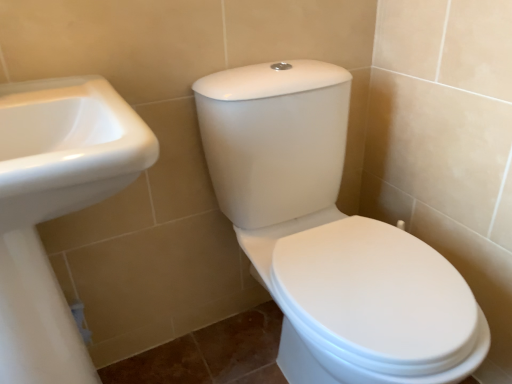
Describe the element at coordinates (55, 209) in the screenshot. I see `white glossy sink at left` at that location.

The height and width of the screenshot is (384, 512). What are the coordinates of `white glossy sink at left` in the screenshot? It's located at (55, 209).

Measure the distance between point (338, 320) and camera.

The depth of point (338, 320) is 74.00 centimeters.

Image resolution: width=512 pixels, height=384 pixels. What do you see at coordinates (329, 236) in the screenshot? I see `white glossy toilet at center` at bounding box center [329, 236].

You are a GUI agent. You are given a task and a screenshot of the screen. Output one action in this format:
    pyautogui.click(x=<x>, y=<y>)
    Task: Click on the white glossy toilet at center
    The width and height of the screenshot is (512, 384).
    Given the screenshot: What is the action you would take?
    pyautogui.click(x=329, y=236)

Image resolution: width=512 pixels, height=384 pixels. Find the location of `white glossy sink at left`. white glossy sink at left is located at coordinates (55, 209).

From the picture: Can you confirm if white glossy sink at left is positioned to the right of white glossy toilet at center?

Incorrect, white glossy sink at left is not on the right side of white glossy toilet at center.

Considering the relative positions of white glossy sink at left and white glossy toilet at center in the image provided, is white glossy sink at left in front of white glossy toilet at center?

Yes, white glossy sink at left is closer to the viewer.

Between point (30, 350) and point (266, 109), which one is positioned in front?

The point (30, 350) is closer to the camera.

From the image's perspective, between white glossy sink at left and white glossy toilet at center, who is located below?

white glossy sink at left appears lower in the image.

From a real-world perspective, is white glossy sink at left over white glossy toilet at center?

Yes.

Which of these two, white glossy sink at left or white glossy toilet at center, is thinner?

white glossy sink at left is thinner.

Between white glossy sink at left and white glossy toilet at center, which one has less height?

white glossy toilet at center.

Does white glossy sink at left have a smaller size compared to white glossy toilet at center?

Yes, white glossy sink at left is smaller than white glossy toilet at center.

Which is correct: white glossy sink at left is inside white glossy toilet at center, or outside of it?

white glossy sink at left exists outside the volume of white glossy toilet at center.

Is white glossy sink at left with white glossy toilet at center?

No, white glossy sink at left is not next to white glossy toilet at center.

Could you tell me if white glossy sink at left is facing white glossy toilet at center?

No, white glossy sink at left is not turned towards white glossy toilet at center.

How many degrees apart are the facing directions of white glossy sink at left and white glossy toilet at center?

The facing directions of white glossy sink at left and white glossy toilet at center are 1.53 degrees apart.

Image resolution: width=512 pixels, height=384 pixels. Identify the location of toilet on the right side of white glossy sink at left. (329, 236).

Is white glossy toilet at center at the left side of white glossy sink at left?

No, white glossy toilet at center is not to the left of white glossy sink at left.

Considering the relative positions of white glossy toilet at center and white glossy sink at left in the image provided, is white glossy toilet at center behind white glossy sink at left?

That is True.

Does point (234, 199) appear closer or farther from the camera than point (69, 166)?

Clearly, point (234, 199) is more distant from the camera than point (69, 166).

From the image's perspective, is white glossy toilet at center under white glossy sink at left?

Actually, white glossy toilet at center appears above white glossy sink at left in the image.

From a real-world perspective, is white glossy toilet at center on top of white glossy sink at left?

No, from a real-world perspective, white glossy toilet at center is not on top of white glossy sink at left.

In terms of width, does white glossy toilet at center look wider or thinner when compared to white glossy sink at left?

Considering their sizes, white glossy toilet at center looks broader than white glossy sink at left.

Who is taller, white glossy toilet at center or white glossy sink at left?

white glossy sink at left.

Is white glossy toilet at center bigger than white glossy sink at left?

Correct, white glossy toilet at center is larger in size than white glossy sink at left.

Would you say white glossy toilet at center contains white glossy sink at left?

No, white glossy sink at left is not a part of white glossy toilet at center.

Can you see white glossy toilet at center touching white glossy sink at left?

No.

Could you tell me if white glossy toilet at center is facing white glossy sink at left?

No, white glossy toilet at center is not aimed at white glossy sink at left.

Can you tell me how much white glossy toilet at center and white glossy sink at left differ in facing direction?

The angular difference between white glossy toilet at center and white glossy sink at left is 1.53 degrees.

I want to click on sink in front of the white glossy toilet at center, so click(55, 209).

Identify the location of toilet located behind the white glossy sink at left. (329, 236).

At what (x,y) coordinates should I click in order to perform the action: click on sink on the left of white glossy toilet at center. Please return your answer as a coordinate pair (x, y). Looking at the image, I should click on (55, 209).